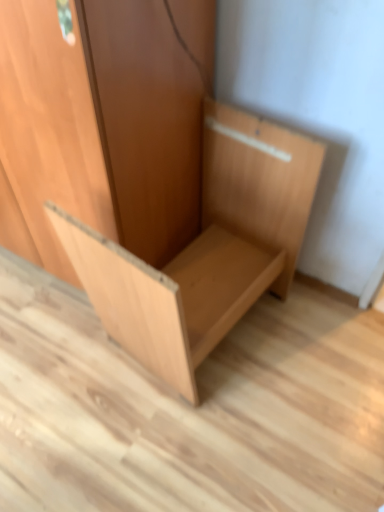
Where is `vacant region to the left of light brown wood chair at center`? This screenshot has width=384, height=512. vacant region to the left of light brown wood chair at center is located at coordinates (52, 362).